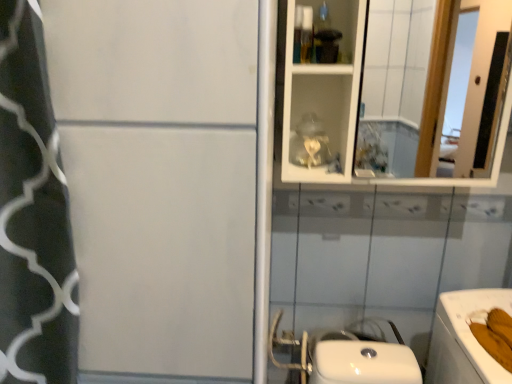
Question: Is point (465, 357) positioned closer to the camera than point (413, 119)?

Choices:
 (A) farther
 (B) closer

Answer: (B)

Question: In terms of width, does white glossy bath at lower right look wider or thinner when compared to white glossy mirror at upper right?

Choices:
 (A) wide
 (B) thin

Answer: (A)

Question: From a real-world perspective, is white glossy bath at lower right physically located above or below white glossy mirror at upper right?

Choices:
 (A) above
 (B) below

Answer: (B)

Question: Looking at their shapes, would you say white glossy mirror at upper right is wider or thinner than white glossy bath at lower right?

Choices:
 (A) wide
 (B) thin

Answer: (B)

Question: In terms of height, does white glossy mirror at upper right look taller or shorter compared to white glossy bath at lower right?

Choices:
 (A) short
 (B) tall

Answer: (B)

Question: Does point (384, 48) appear closer or farther from the camera than point (450, 314)?

Choices:
 (A) farther
 (B) closer

Answer: (A)

Question: In terms of size, does white glossy mirror at upper right appear bigger or smaller than white glossy bath at lower right?

Choices:
 (A) small
 (B) big

Answer: (A)